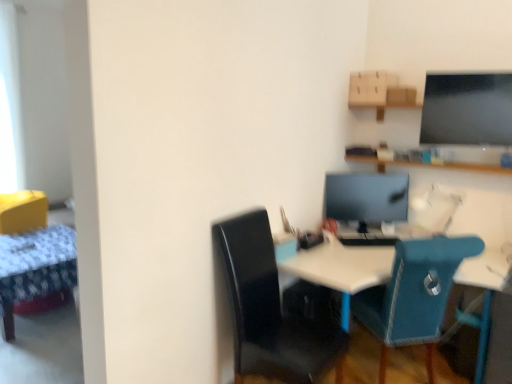
Where is `vacant point above matte black monitor at center (from a real-world perspective)`? Image resolution: width=512 pixels, height=384 pixels. vacant point above matte black monitor at center (from a real-world perspective) is located at coordinates (365, 175).